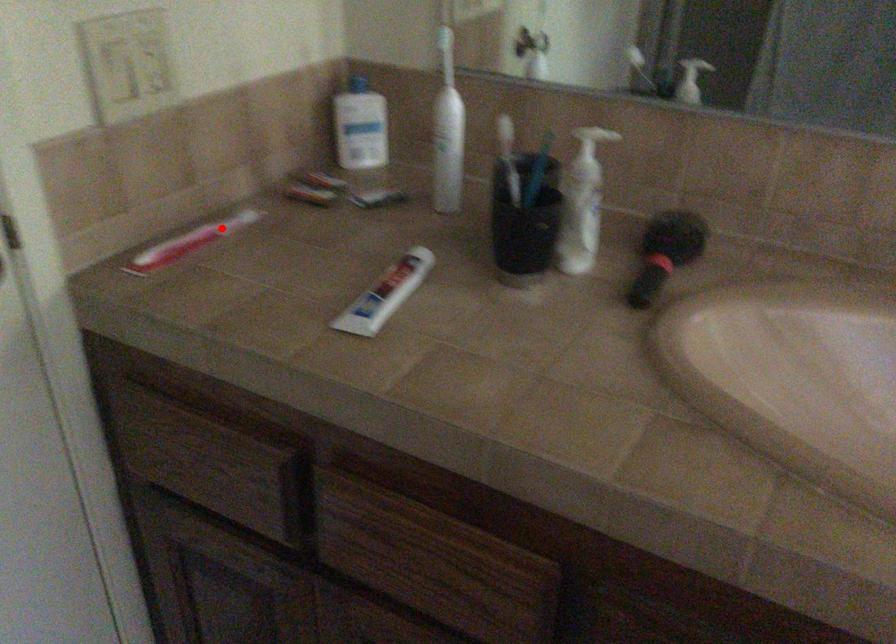
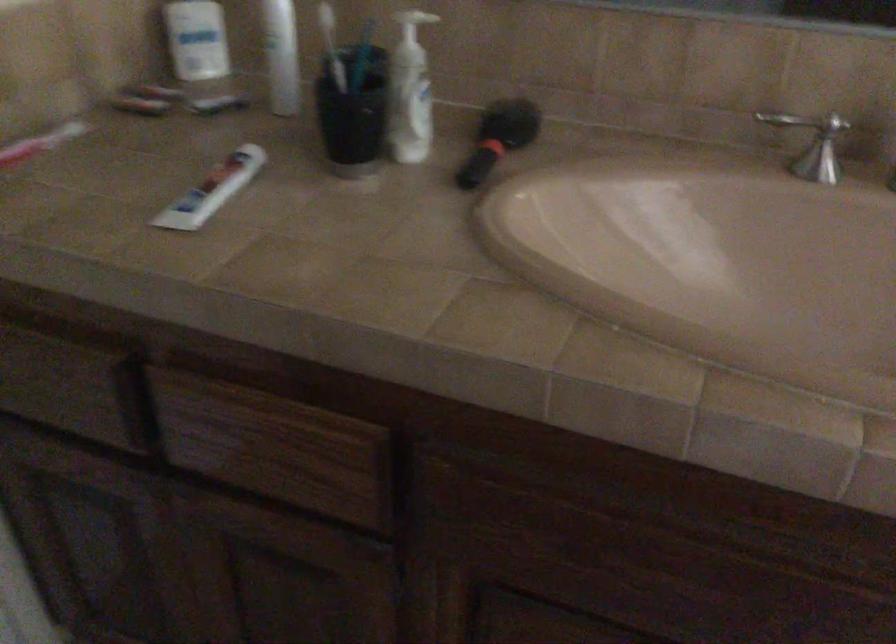
Where in the second image is the point corresponding to the highlighted location from the first image?

(42, 145)